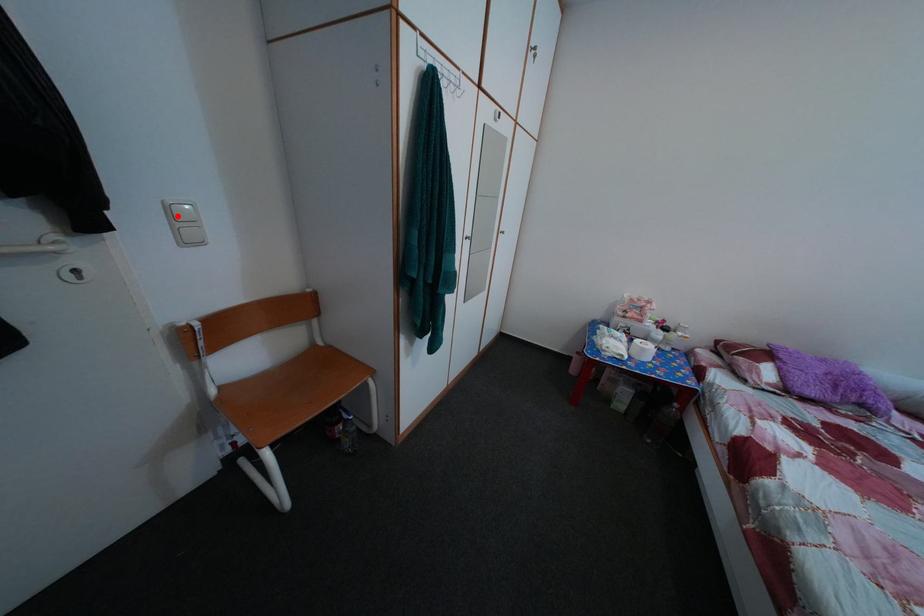
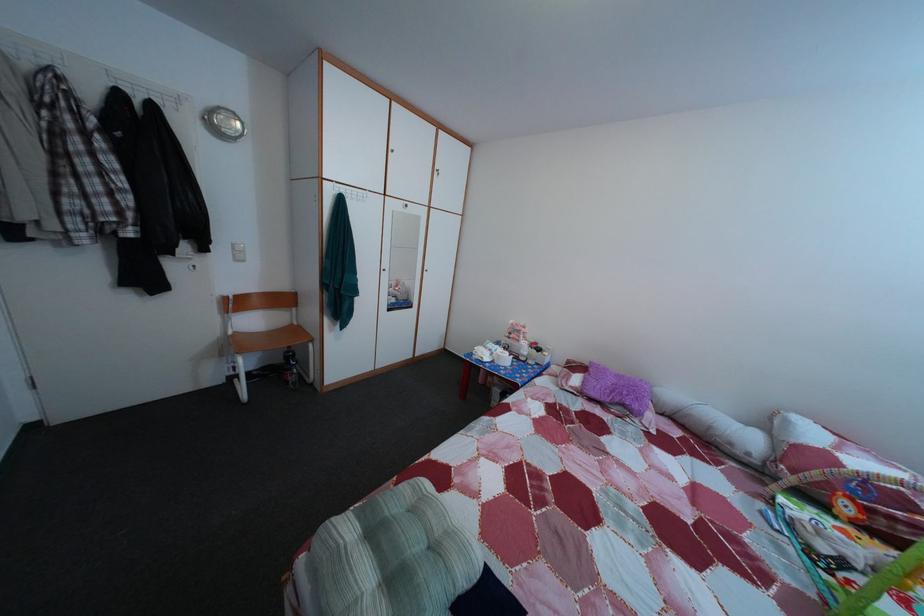
Question: I am providing you with two images of the same scene from different viewpoints. A red point is shown in image1. For the corresponding object point in image2, is it positioned nearer or farther from the camera?

Choices:
 (A) Nearer
 (B) Farther

Answer: (A)